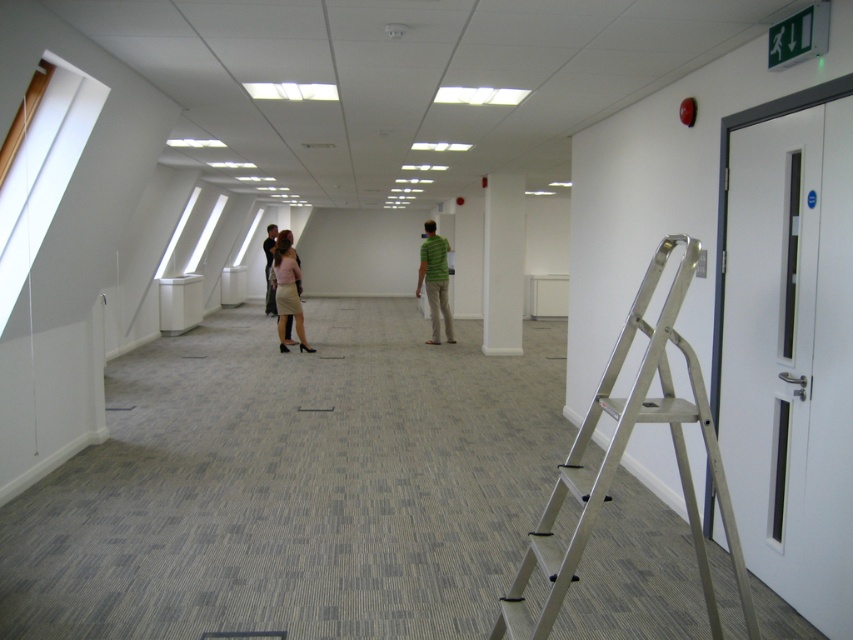
You are standing in the room and see the point at coordinates (x=287, y=291). What object is located at that point?

The point at coordinates (x=287, y=291) is located on the matte beige skirt at center.

You are a tailor who needs to determine which clothing item takes up more horizontal space when worn. Based on the image, which is wider between the green matte shirt at center and the matte beige skirt at center?

The green matte shirt at center is wider than the matte beige skirt at center according to the description.